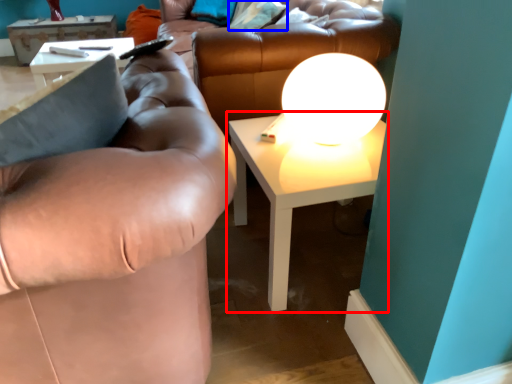
Question: Which point is closer to the camera, table (highlighted by a red box) or pillow (highlighted by a blue box)?

Choices:
 (A) table
 (B) pillow

Answer: (A)